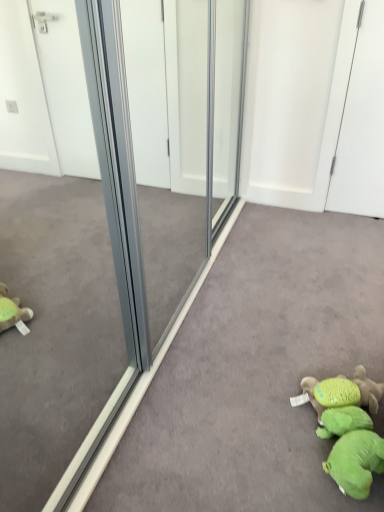
Question: Does green plush toy at lower right, the 2th toy viewed from the back, have a lesser height compared to green plush toy at lower right, which is counted as the 1th toy, starting from the back?

Choices:
 (A) no
 (B) yes

Answer: (B)

Question: Does green plush toy at lower right, marked as the 1th toy in a front-to-back arrangement, appear on the left side of green plush toy at lower right, which is counted as the 1th toy, starting from the back?

Choices:
 (A) yes
 (B) no

Answer: (A)

Question: Considering the relative sizes of green plush toy at lower right, the 2th toy viewed from the back, and green plush toy at lower right, which is counted as the 1th toy, starting from the back, in the image provided, is green plush toy at lower right, the 2th toy viewed from the back, bigger than green plush toy at lower right, which is counted as the 1th toy, starting from the back,?

Choices:
 (A) no
 (B) yes

Answer: (B)

Question: Is green plush toy at lower right, the 2th toy viewed from the back, thinner than green plush toy at lower right, which is counted as the 1th toy, starting from the back?

Choices:
 (A) no
 (B) yes

Answer: (B)

Question: Is green plush toy at lower right, marked as the 1th toy in a front-to-back arrangement, facing away from green plush toy at lower right, which is counted as the 1th toy, starting from the back?

Choices:
 (A) yes
 (B) no

Answer: (B)

Question: Is green plush toy at lower right, the 2th toy viewed from the back, taller than green plush toy at lower right, which is counted as the 1th toy, starting from the back?

Choices:
 (A) yes
 (B) no

Answer: (B)

Question: From a real-world perspective, is white glossy screen door at upper right under green plush toy at lower right, the second toy positioned from the front?

Choices:
 (A) yes
 (B) no

Answer: (B)

Question: Does white glossy screen door at upper right have a greater height compared to green plush toy at lower right, the second toy positioned from the front?

Choices:
 (A) yes
 (B) no

Answer: (A)

Question: Does white glossy screen door at upper right have a smaller size compared to green plush toy at lower right, the second toy positioned from the front?

Choices:
 (A) no
 (B) yes

Answer: (A)

Question: Is white glossy screen door at upper right at the right side of green plush toy at lower right, which is counted as the 1th toy, starting from the back?

Choices:
 (A) yes
 (B) no

Answer: (A)

Question: Does white glossy screen door at upper right have a greater width compared to green plush toy at lower right, the second toy positioned from the front?

Choices:
 (A) yes
 (B) no

Answer: (B)

Question: Is white glossy screen door at upper right facing towards green plush toy at lower right, the second toy positioned from the front?

Choices:
 (A) yes
 (B) no

Answer: (A)

Question: From a real-world perspective, is green plush toy at lower right, the second toy positioned from the front, beneath green plush toy at lower right, the 2th toy viewed from the back?

Choices:
 (A) no
 (B) yes

Answer: (A)